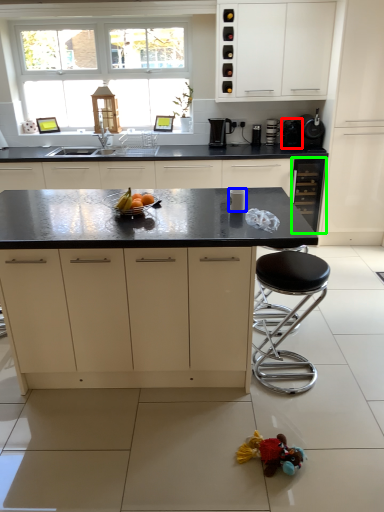
Question: Which object is positioned farthest from appliance (highlighted by a red box)? Select from appliance (highlighted by a blue box) and cabinetry (highlighted by a green box).

Choices:
 (A) appliance
 (B) cabinetry

Answer: (A)